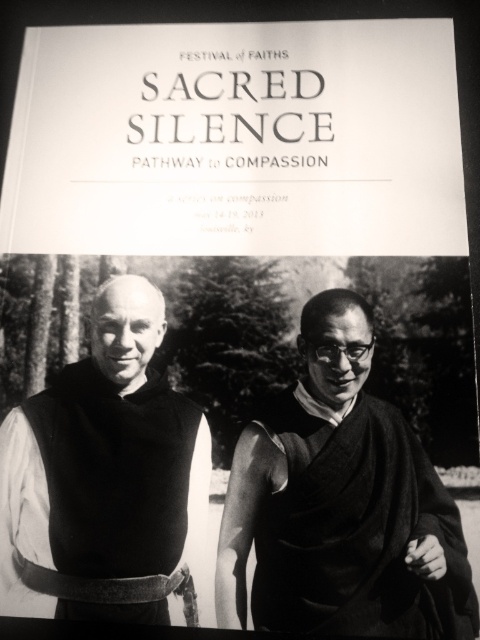
You are a photographer reviewing the image to ensure all clothing items are correctly positioned. According to the coordinates provided, where exactly is the matte black vest at left located?

The matte black vest at left is located at point (106, 477).

Looking at the promotional image for the Festival of Faiths, you notice the white paper at upper center and the black woolen robe at right. Which object is positioned higher in the image?

The white paper at upper center is positioned higher than the black woolen robe at right.

Based on the Festival of Faiths event image, which object, the white paper at upper center or the matte black vest at left, has a greater width?

The white paper at upper center might be wider than matte black vest at left according to the description.